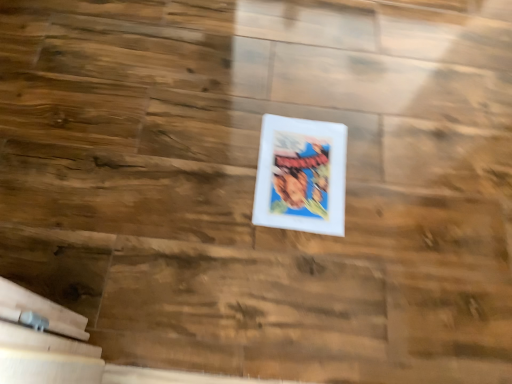
The width and height of the screenshot is (512, 384). Identify the location of vacant area that lies to the right of white matte picture frame at center. (396, 197).